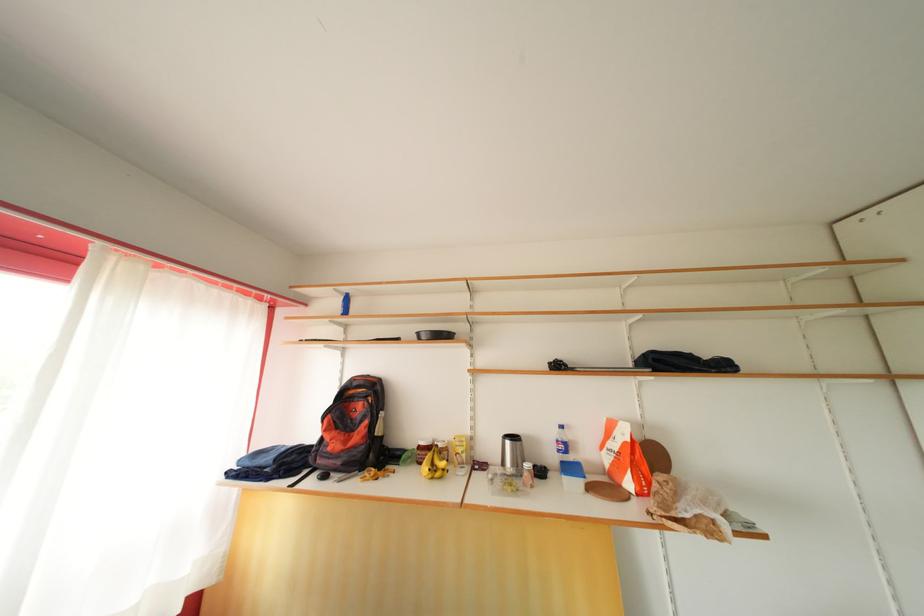
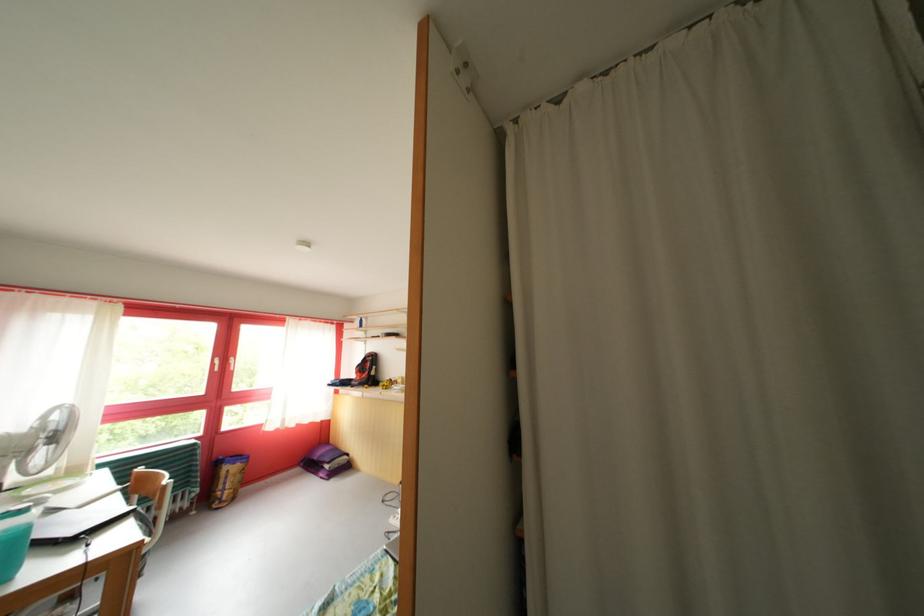
What movement of the cameraman would produce the second image?

The cameraman moved toward right, backward.